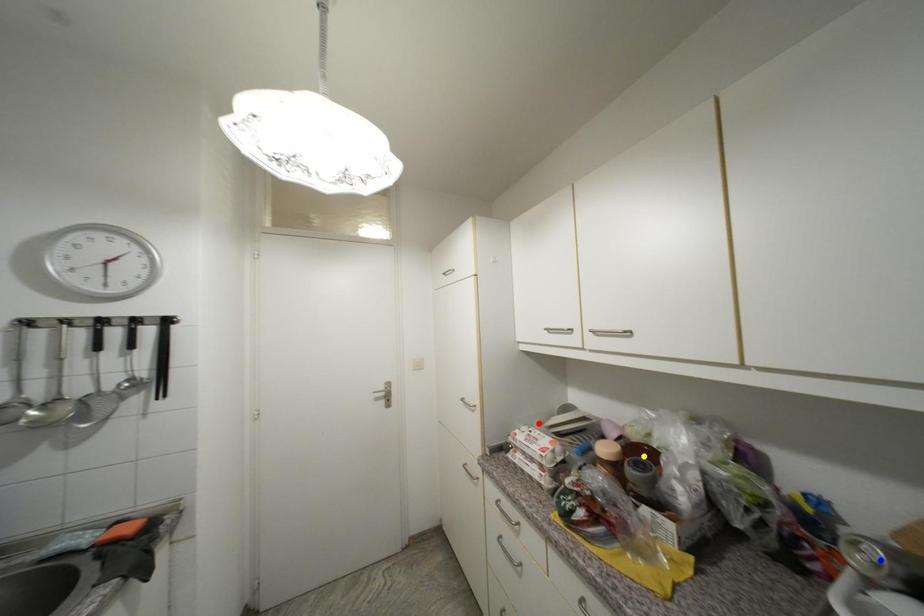
Order these from nearest to farthest:
- blue point
- yellow point
- red point

blue point → yellow point → red point